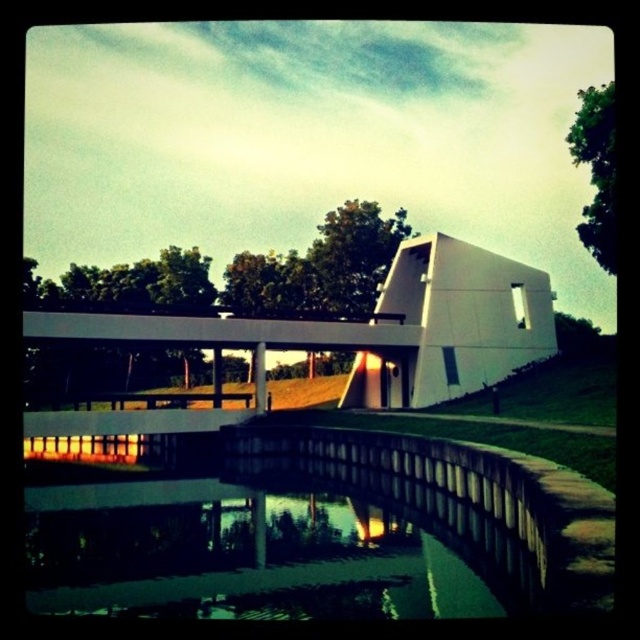
Question: Among these objects, which one is farthest from the camera?

Choices:
 (A) green reflective water at lower center
 (B) white smooth bridge at center

Answer: (B)

Question: Can you confirm if green reflective water at lower center is wider than white smooth bridge at center?

Choices:
 (A) no
 (B) yes

Answer: (A)

Question: Among these points, which one is nearest to the camera?

Choices:
 (A) (196, 492)
 (B) (497, 301)

Answer: (A)

Question: Which point is closer to the camera taking this photo?

Choices:
 (A) (74, 564)
 (B) (104, 340)

Answer: (A)

Question: Is green reflective water at lower center to the left of white smooth bridge at center from the viewer's perspective?

Choices:
 (A) no
 (B) yes

Answer: (B)

Question: Does green reflective water at lower center appear over white smooth bridge at center?

Choices:
 (A) yes
 (B) no

Answer: (B)